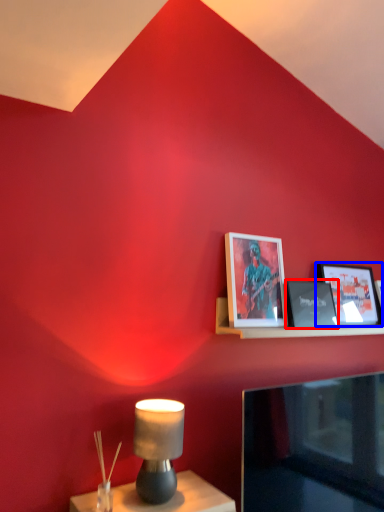
Question: Which of the following is the farthest to the observer, picture frame (highlighted by a red box) or picture frame (highlighted by a blue box)?

Choices:
 (A) picture frame
 (B) picture frame

Answer: (B)